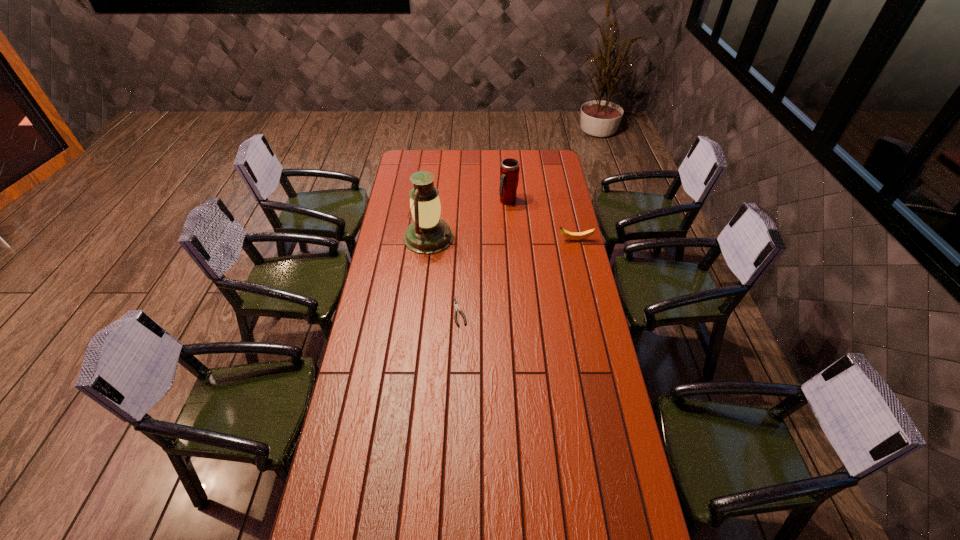
Image resolution: width=960 pixels, height=540 pixels. I want to click on the third object from right to left, so click(456, 306).

This screenshot has height=540, width=960. In order to click on the nearest object in this screenshot , I will do `click(456, 306)`.

The height and width of the screenshot is (540, 960). Identify the location of banana. (586, 234).

This screenshot has width=960, height=540. What are the coordinates of `the rightmost object` in the screenshot? It's located at (586, 234).

This screenshot has height=540, width=960. I want to click on the second tallest object, so click(509, 170).

Find the location of `the farthest object`. the farthest object is located at coordinates tap(509, 170).

Find the location of a particular element. This screenshot has width=960, height=540. the leftmost object is located at coordinates (427, 234).

This screenshot has width=960, height=540. Find the location of `the tallest object`. the tallest object is located at coordinates (427, 234).

Identify the location of blank area located on the right of the nearest object. Image resolution: width=960 pixels, height=540 pixels. (559, 312).

Locate an element on the screen. The width and height of the screenshot is (960, 540). free spot located at the stem of the second shortest object is located at coordinates (534, 240).